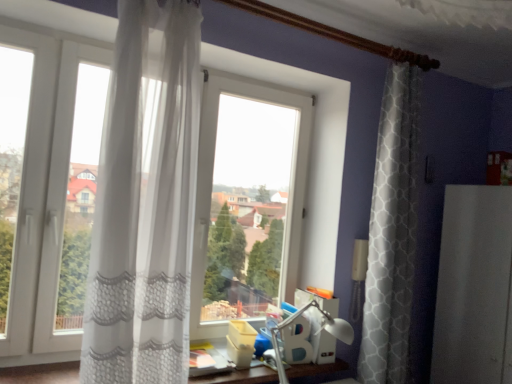
Question: Relative to white plastic table lamp at center, is white sheer curtain at left in front or behind?

Choices:
 (A) front
 (B) behind

Answer: (A)

Question: Is point (172, 33) positioned closer to the camera than point (337, 324)?

Choices:
 (A) farther
 (B) closer

Answer: (B)

Question: Estimate the real-world distances between objects in this image. Which object is farther from the white sheer curtain at left?

Choices:
 (A) white plastic table lamp at center
 (B) white matte screen door at right

Answer: (B)

Question: Which object is positioned closest to the white matte screen door at right?

Choices:
 (A) white sheer curtain at left
 (B) white plastic table lamp at center

Answer: (B)